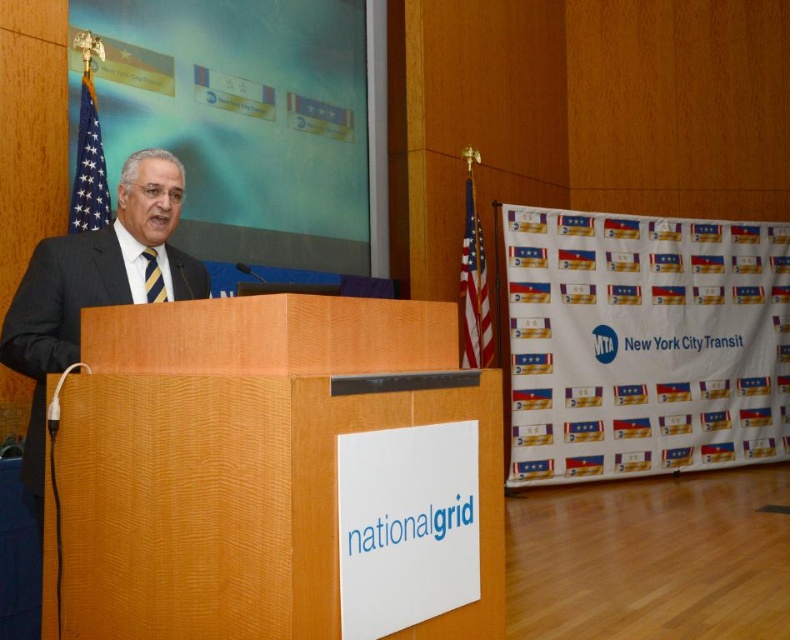
You are an event organizer who needs to ensure proper visibility for the audience. Considering the placement of the dark suit at left and the matte black flag at upper left, which object might be blocking the view of the other?

The matte black flag at upper left is positioned above the dark suit at left, so it might be blocking the view of the dark suit at left from certain angles.